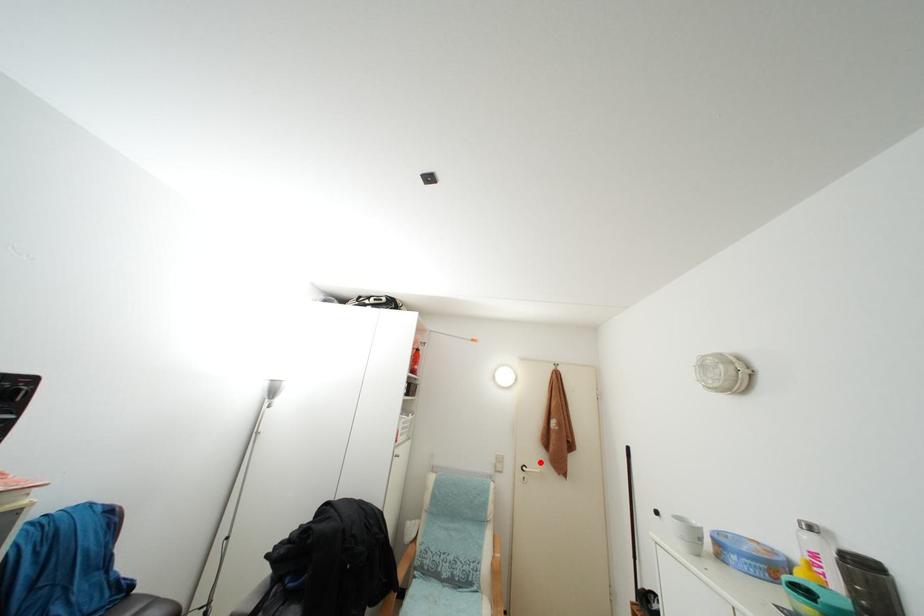
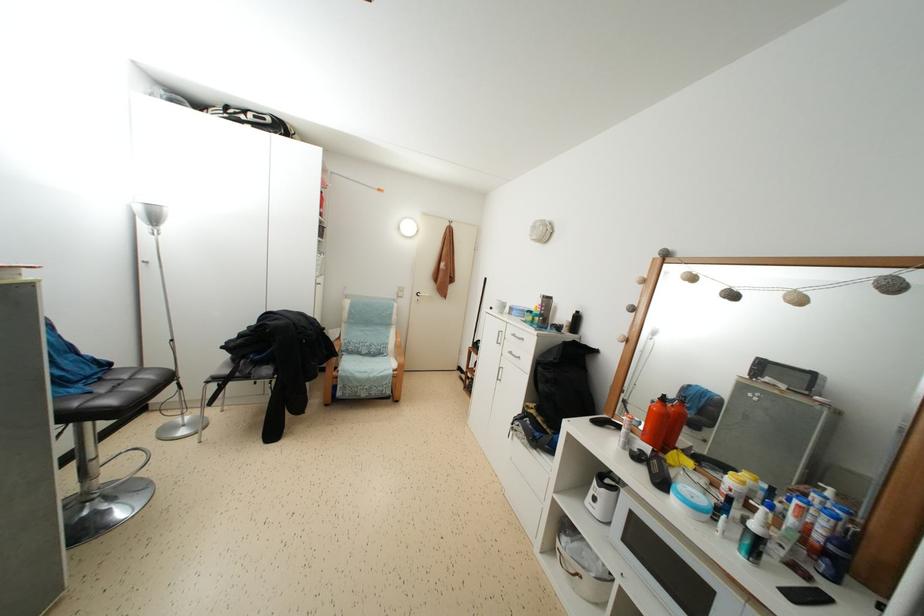
Question: A red point is marked in image1. In image2, is the corresponding 3D point closer to the camera or farther? Reply with the corresponding letter.

Choices:
 (A) The corresponding 3D point is closer.
 (B) The corresponding 3D point is farther.

Answer: (A)